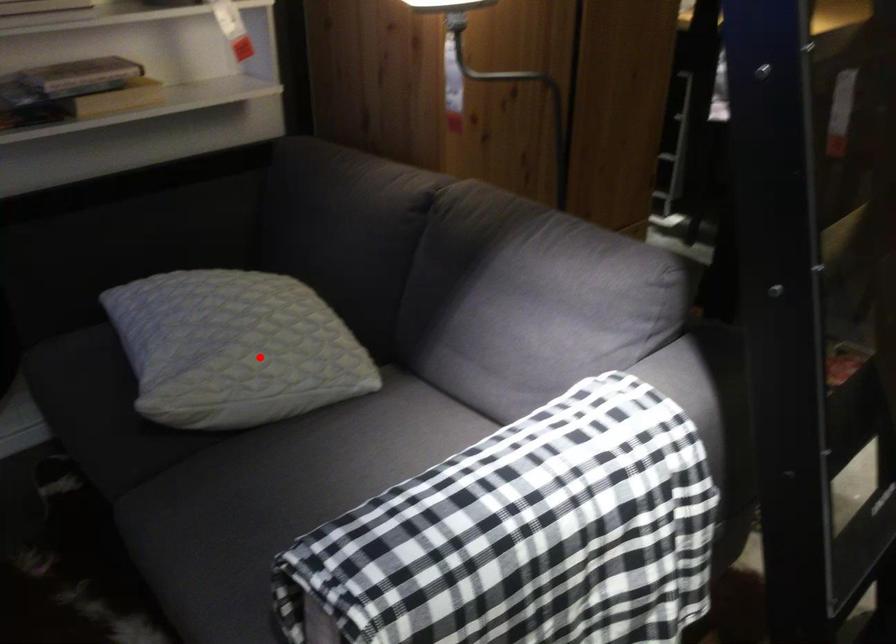
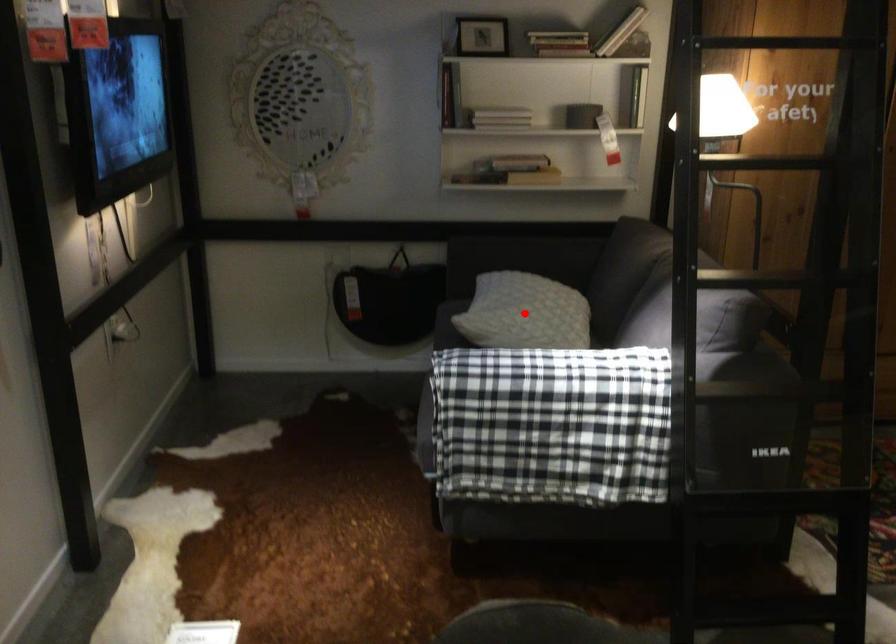
I am providing you with two images of the same scene from different viewpoints. A red point is marked on the first image and another point is marked on the second image. Is the marked point in image1 the same physical position as the marked point in image2?

Yes